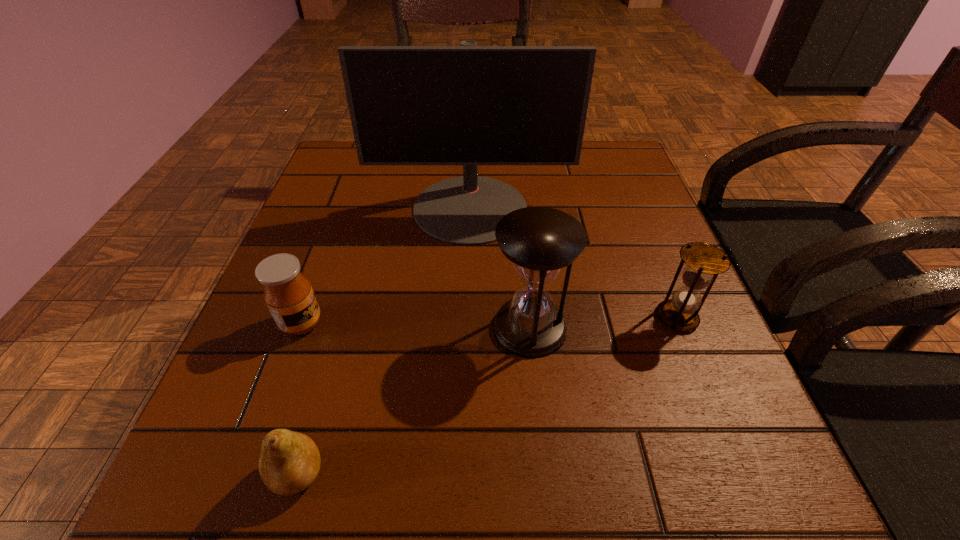
At what (x,y) coordinates should I click in order to perform the action: click on the tallest object. Please return your answer as a coordinate pair (x, y). Image resolution: width=960 pixels, height=540 pixels. Looking at the image, I should click on (469, 105).

Locate an element on the screen. computer monitor is located at coordinates (469, 105).

Where is `the second tallest object`? the second tallest object is located at coordinates (539, 241).

Locate an element on the screen. This screenshot has width=960, height=540. the left hourglass is located at coordinates (539, 241).

The width and height of the screenshot is (960, 540). What are the coordinates of `the right hourglass` in the screenshot? It's located at (704, 262).

Locate an element on the screen. The height and width of the screenshot is (540, 960). the rightmost object is located at coordinates (704, 262).

Where is `honey`? The width and height of the screenshot is (960, 540). honey is located at coordinates (288, 294).

This screenshot has width=960, height=540. Find the location of `the nearest object`. the nearest object is located at coordinates (290, 461).

Identify the location of free space located on the screen of the tallest object. (466, 372).

Find the location of a particular element. free space located on the left of the left hourglass is located at coordinates (321, 327).